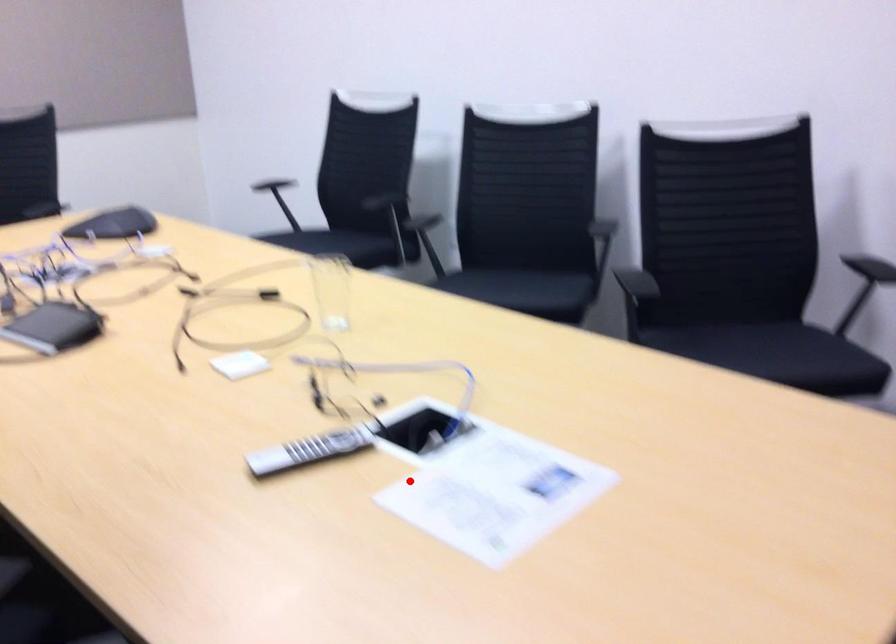
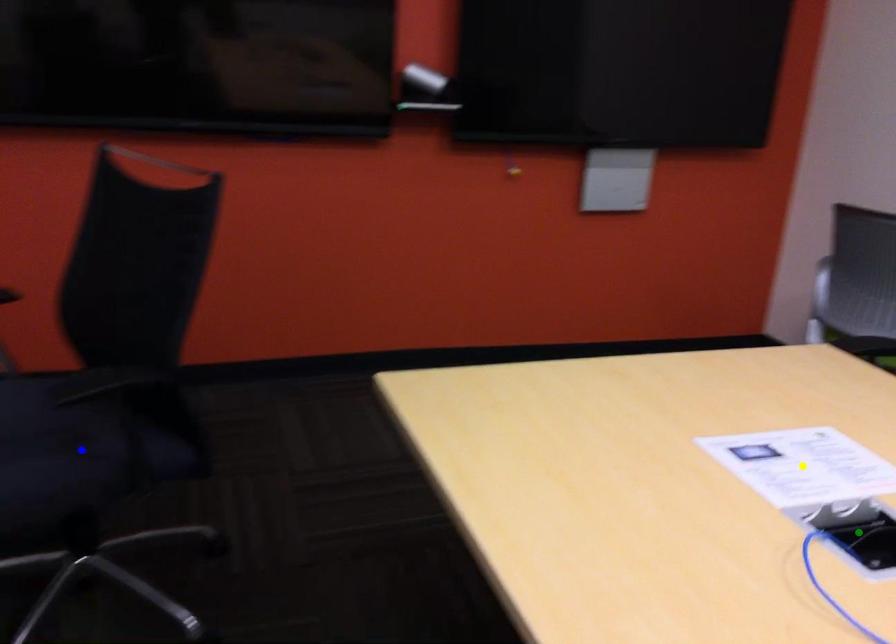
Question: I am providing you with two images of the same scene from different viewpoints. A red point is marked on the first image. You are given multiple points on the second image. Which point in image 2 represents the same 3d spot as the red point in image 1?

Choices:
 (A) yellow point
 (B) blue point
 (C) green point

Answer: (C)